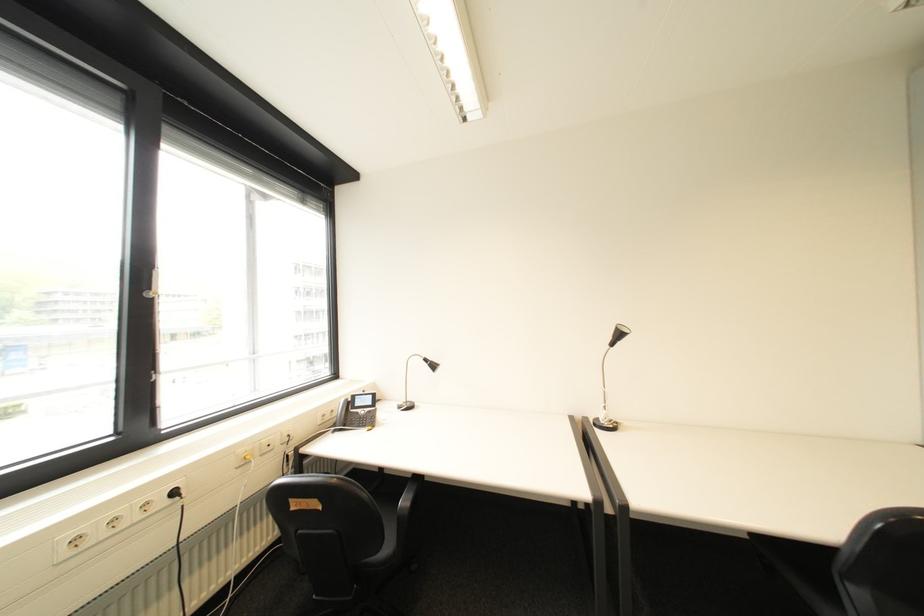
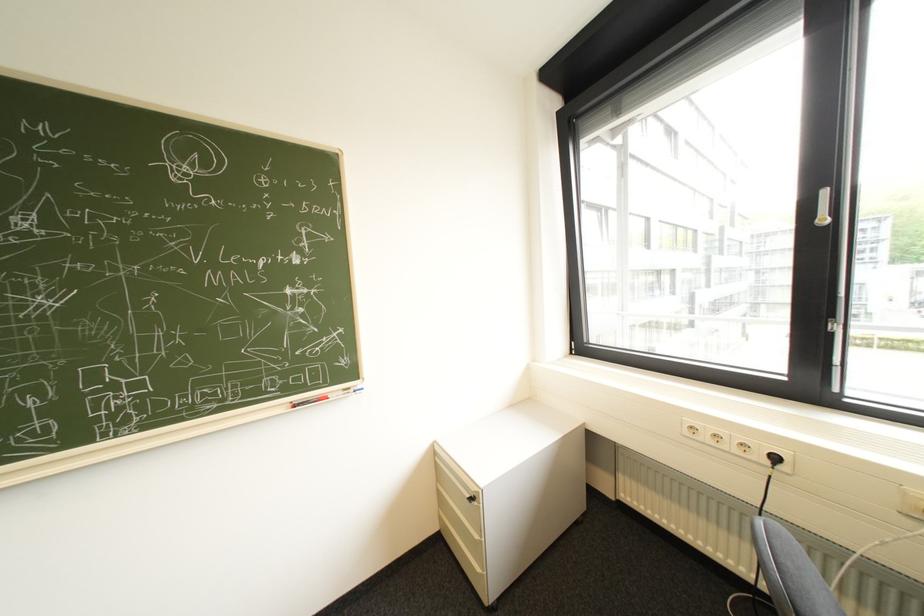
Locate, in the second image, the point that corresponds to (78,554) in the first image.

(698, 434)